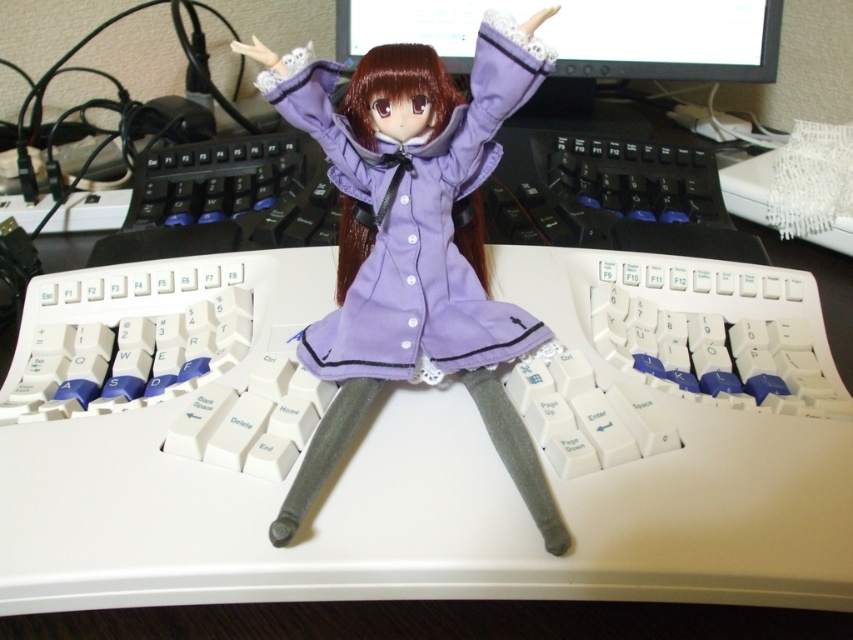
Question: Does purple fabric doll at center have a lesser width compared to matte black monitor at upper center?

Choices:
 (A) yes
 (B) no

Answer: (A)

Question: Which of the following is the closest to the observer?

Choices:
 (A) (321, 65)
 (B) (682, 19)

Answer: (A)

Question: Can you confirm if purple fabric doll at center is positioned to the left of matte black monitor at upper center?

Choices:
 (A) yes
 (B) no

Answer: (A)

Question: Is purple fabric doll at center smaller than matte black monitor at upper center?

Choices:
 (A) no
 (B) yes

Answer: (B)